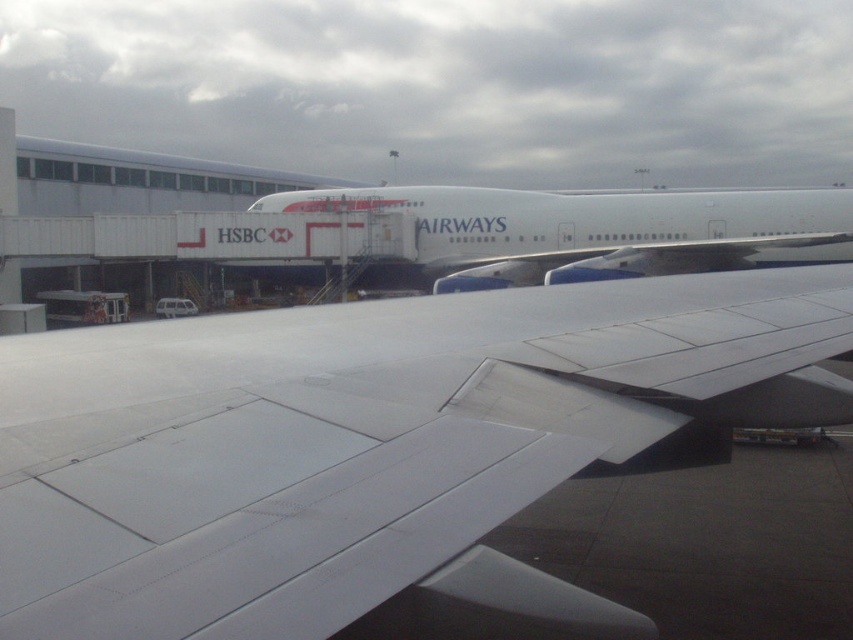
Is white matte wing at center smaller than white glossy airplane at center?

Yes, white matte wing at center is smaller than white glossy airplane at center.

Based on the photo, which of these two, white matte wing at center or white glossy airplane at center, stands shorter?

With less height is white matte wing at center.

Does point (12, 452) lie behind point (659, 230)?

No, (12, 452) is closer to viewer.

Find the location of a particular element. The width and height of the screenshot is (853, 640). white matte wing at center is located at coordinates (376, 451).